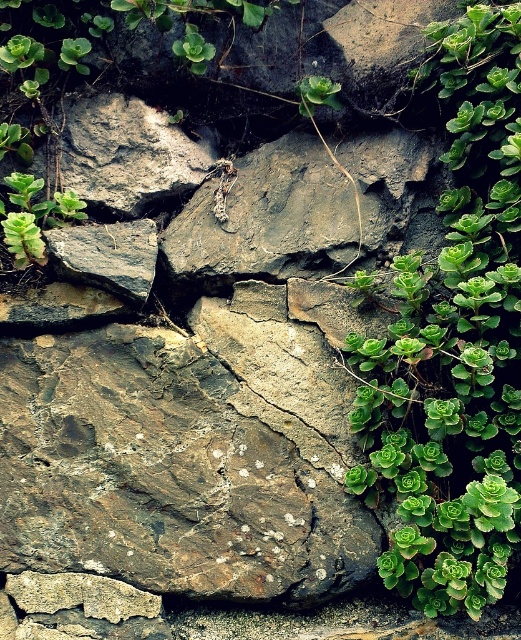
You are a gardener looking at this rocky area. You notice the rusty stone wall at center and the green succulent at right. Which object is positioned lower in the scene?

The rusty stone wall at center is positioned lower than the green succulent at right.

You are a gardener who wants to water the green succulent at right without getting the rusty stone wall at center wet. Can you reach the succulent with a watering can that has a 10 inch long handle?

The rusty stone wall at center is 11.41 inches away from the green succulent at right. Since the watering can handle is 10 inches long, you cannot reach the green succulent at right without touching the rusty stone wall at center.